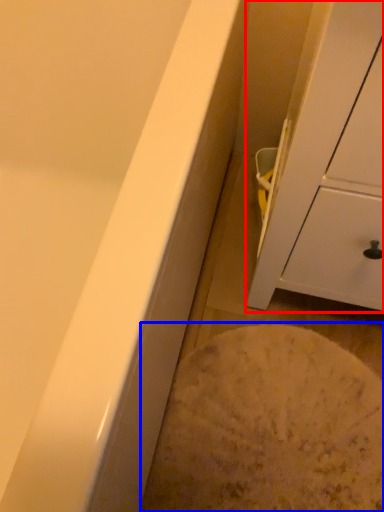
Question: Which object appears closest to the camera in this image, cabinetry (highlighted by a red box) or flour (highlighted by a blue box)?

Choices:
 (A) cabinetry
 (B) flour

Answer: (A)